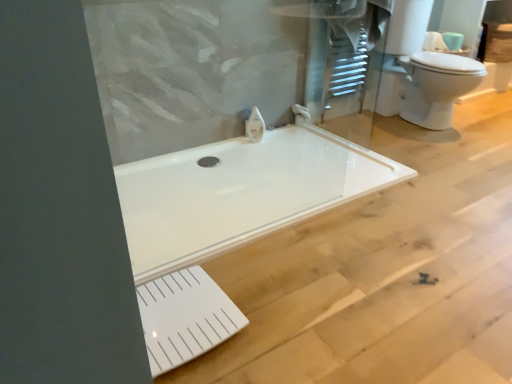
I want to click on vacant point to the left of white glossy faucet at upper center, which is the first faucet in front-to-back order, so click(228, 144).